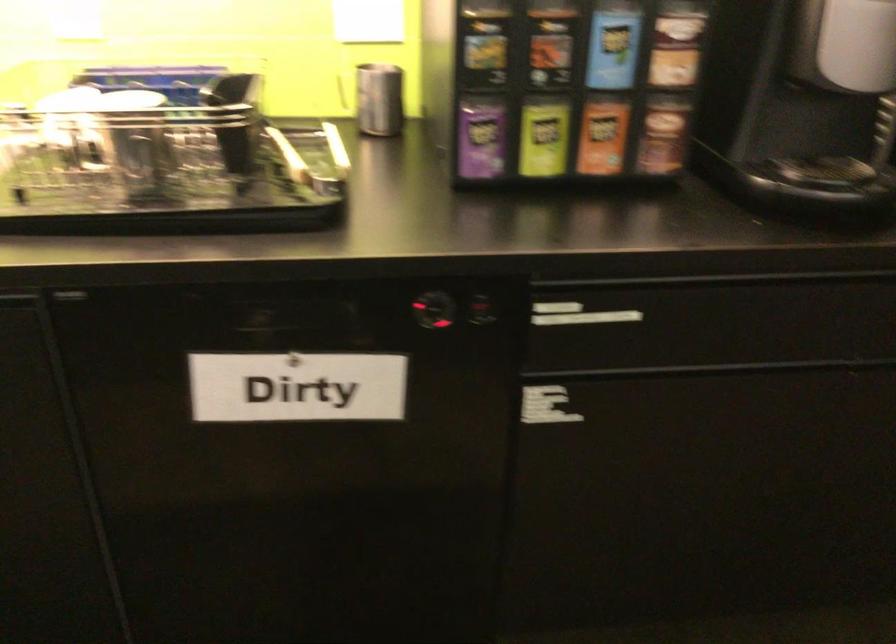
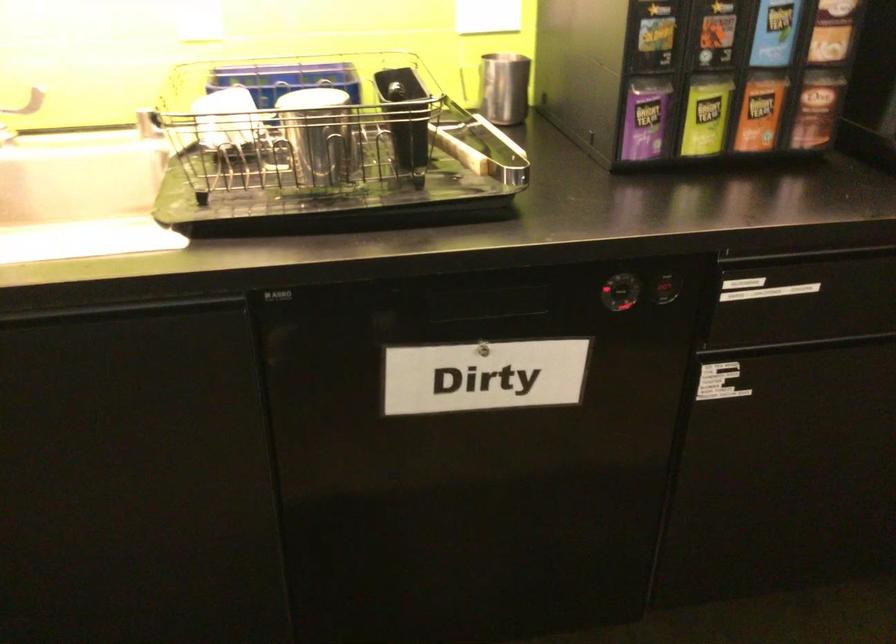
Find the pixel in the second image that matches [661,136] in the first image.

(816, 109)